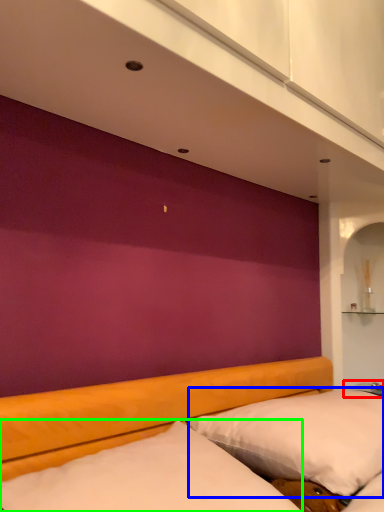
Question: Estimate the real-world distances between objects in this image. Which object is closer to table (highlighted by a red box), pillow (highlighted by a blue box) or mattress (highlighted by a green box)?

Choices:
 (A) pillow
 (B) mattress

Answer: (A)